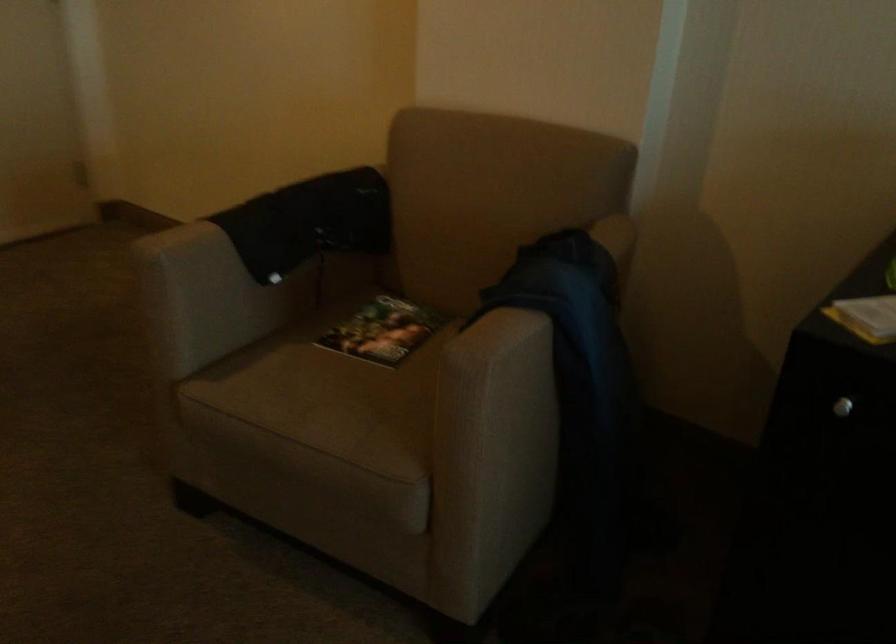
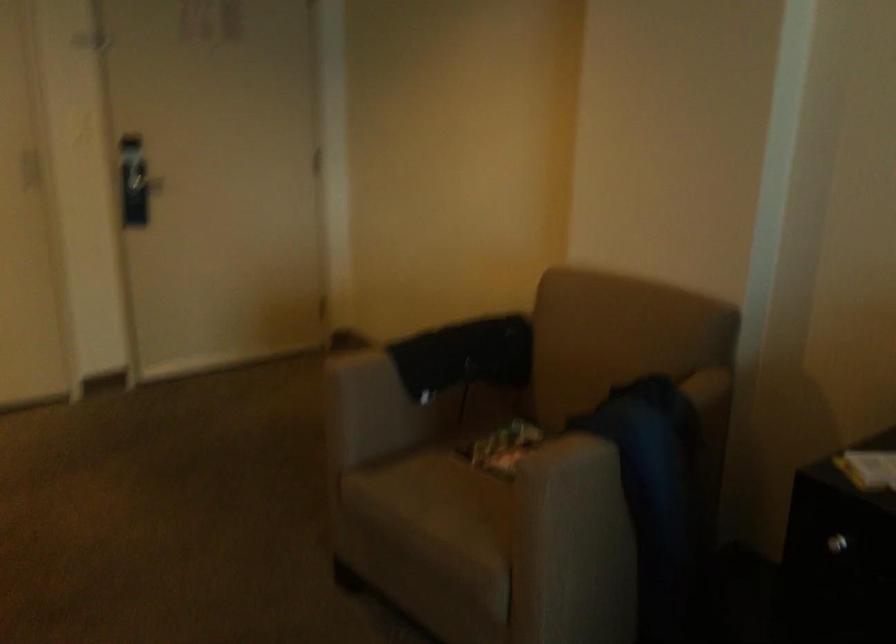
Where in the second image is the point corresponding to point 334,399 from the first image?

(453, 500)